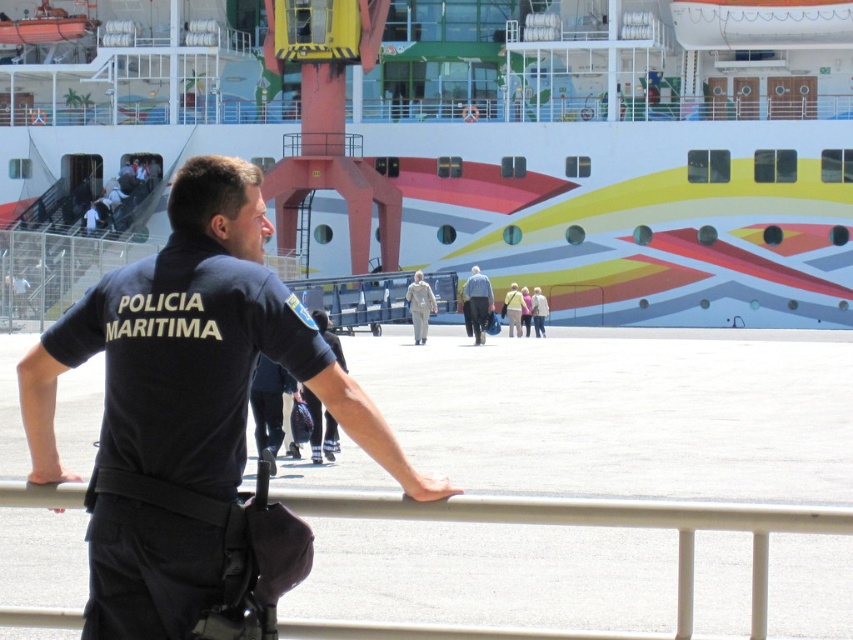
You are a photographer trying to capture the black uniform at center and the white metal rail at center in the same frame. Based on their sizes, which object should you focus on first to ensure both fit in the photo?

Since the black uniform at center is larger than the white metal rail at center, you should focus on the black uniform at center first to ensure both fit in the photo.

You are a tourist standing at the port and see the black uniform at center and the white metal rail at center. Which object is nearer to you?

The black uniform at center is closer to the viewer than the white metal rail at center.